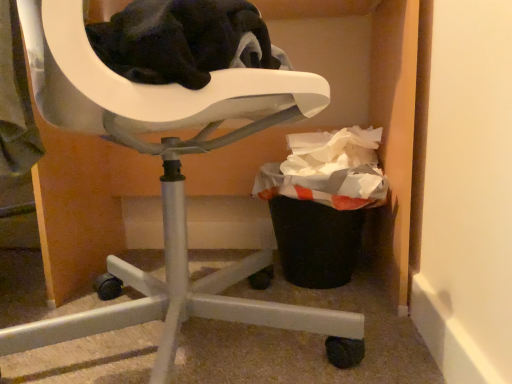
The height and width of the screenshot is (384, 512). What are the coordinates of `white plastic chair at upper left` in the screenshot? It's located at (168, 182).

Describe the element at coordinates (168, 182) in the screenshot. I see `white plastic chair at upper left` at that location.

Measure the distance between black plastic trash can at lower right and camera.

black plastic trash can at lower right is 34.65 inches from camera.

In order to face black plastic trash can at lower right, should I rotate leftwards or rightwards?

Rotate right and turn 8.441 degrees.

What is the approximate width of black plastic trash can at lower right?

The width of black plastic trash can at lower right is 31.45 centimeters.

Describe the element at coordinates (313, 227) in the screenshot. The width and height of the screenshot is (512, 384). I see `black plastic trash can at lower right` at that location.

This screenshot has height=384, width=512. In order to click on black plastic trash can at lower right in this screenshot , I will do `click(313, 227)`.

Locate an element on the screen. This screenshot has width=512, height=384. white plastic chair at upper left is located at coordinates (168, 182).

Considering the positions of objects black plastic trash can at lower right and white plastic chair at upper left in the image provided, who is more to the left, black plastic trash can at lower right or white plastic chair at upper left?

From the viewer's perspective, white plastic chair at upper left appears more on the left side.

Is the depth of black plastic trash can at lower right greater than that of white plastic chair at upper left?

That is True.

Does point (280, 240) come in front of point (292, 72)?

No, it is not.

From the image's perspective, is black plastic trash can at lower right beneath white plastic chair at upper left?

Correct, black plastic trash can at lower right appears lower than white plastic chair at upper left in the image.

From a real-world perspective, is black plastic trash can at lower right positioned over white plastic chair at upper left based on gravity?

Incorrect, from a real-world perspective, black plastic trash can at lower right is lower than white plastic chair at upper left.

Considering the sizes of objects black plastic trash can at lower right and white plastic chair at upper left in the image provided, who is wider, black plastic trash can at lower right or white plastic chair at upper left?

white plastic chair at upper left.

Considering the sizes of objects black plastic trash can at lower right and white plastic chair at upper left in the image provided, who is shorter, black plastic trash can at lower right or white plastic chair at upper left?

With less height is black plastic trash can at lower right.

Considering the relative sizes of black plastic trash can at lower right and white plastic chair at upper left in the image provided, is black plastic trash can at lower right smaller than white plastic chair at upper left?

Indeed, black plastic trash can at lower right has a smaller size compared to white plastic chair at upper left.

Is black plastic trash can at lower right surrounding white plastic chair at upper left?

No, white plastic chair at upper left is not inside black plastic trash can at lower right.

From the picture: Is black plastic trash can at lower right in contact with white plastic chair at upper left?

No, black plastic trash can at lower right is not making contact with white plastic chair at upper left.

Does black plastic trash can at lower right turn towards white plastic chair at upper left?

Yes, black plastic trash can at lower right is turned towards white plastic chair at upper left.

How many degrees apart are the facing directions of black plastic trash can at lower right and white plastic chair at upper left?

The angular difference between black plastic trash can at lower right and white plastic chair at upper left is 138 degrees.

There is a black plastic trash can at lower right. At what (x,y) coordinates should I click in order to perform the action: click on chair above it (from a real-world perspective). Please return your answer as a coordinate pair (x, y). Looking at the image, I should click on (168, 182).

Between white plastic chair at upper left and black plastic trash can at lower right, which one appears on the right side from the viewer's perspective?

black plastic trash can at lower right.

Is the position of white plastic chair at upper left more distant than that of black plastic trash can at lower right?

No, white plastic chair at upper left is closer to the viewer.

Does point (220, 309) come behind point (319, 218)?

No, (220, 309) is in front of (319, 218).

From the image's perspective, which one is positioned higher, white plastic chair at upper left or black plastic trash can at lower right?

From the image's view, white plastic chair at upper left is above.

From a real-world perspective, is white plastic chair at upper left positioned under black plastic trash can at lower right based on gravity?

Incorrect, from a real-world perspective, white plastic chair at upper left is higher than black plastic trash can at lower right.

Is white plastic chair at upper left wider than black plastic trash can at lower right?

Yes, white plastic chair at upper left is wider than black plastic trash can at lower right.

Is white plastic chair at upper left shorter than black plastic trash can at lower right?

Incorrect, the height of white plastic chair at upper left does not fall short of that of black plastic trash can at lower right.

Looking at this image, considering the sizes of objects white plastic chair at upper left and black plastic trash can at lower right in the image provided, who is smaller, white plastic chair at upper left or black plastic trash can at lower right?

Smaller between the two is black plastic trash can at lower right.

Is white plastic chair at upper left surrounding black plastic trash can at lower right?

No, white plastic chair at upper left does not contain black plastic trash can at lower right.

Is white plastic chair at upper left far from black plastic trash can at lower right?

→ white plastic chair at upper left is near black plastic trash can at lower right, not far away.

Is white plastic chair at upper left oriented towards black plastic trash can at lower right?

Yes, white plastic chair at upper left faces towards black plastic trash can at lower right.

I want to click on chair in front of the black plastic trash can at lower right, so click(x=168, y=182).

Find the location of a particular element. Image resolution: width=512 pixels, height=384 pixels. chair in front of the black plastic trash can at lower right is located at coordinates (168, 182).

This screenshot has height=384, width=512. I want to click on chair above the black plastic trash can at lower right (from a real-world perspective), so click(x=168, y=182).